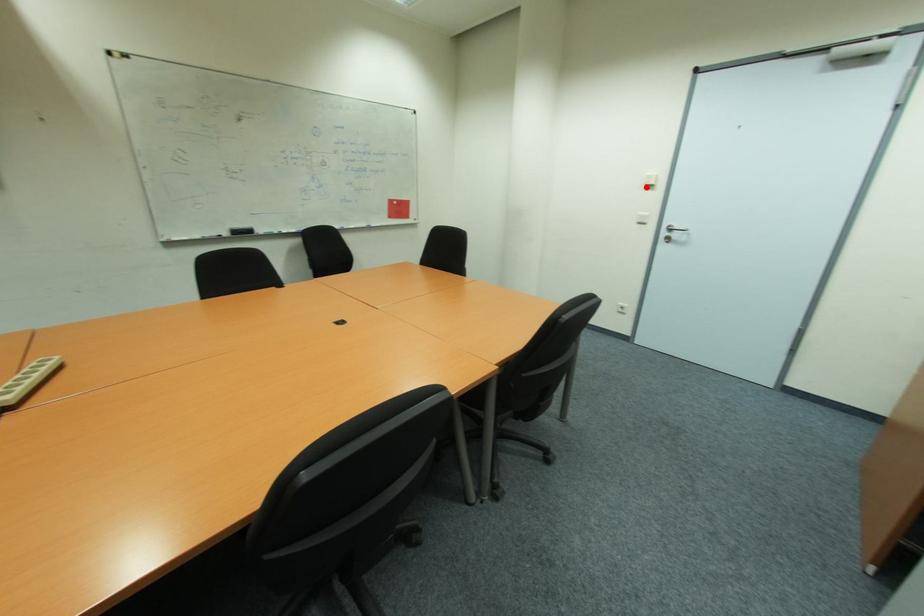
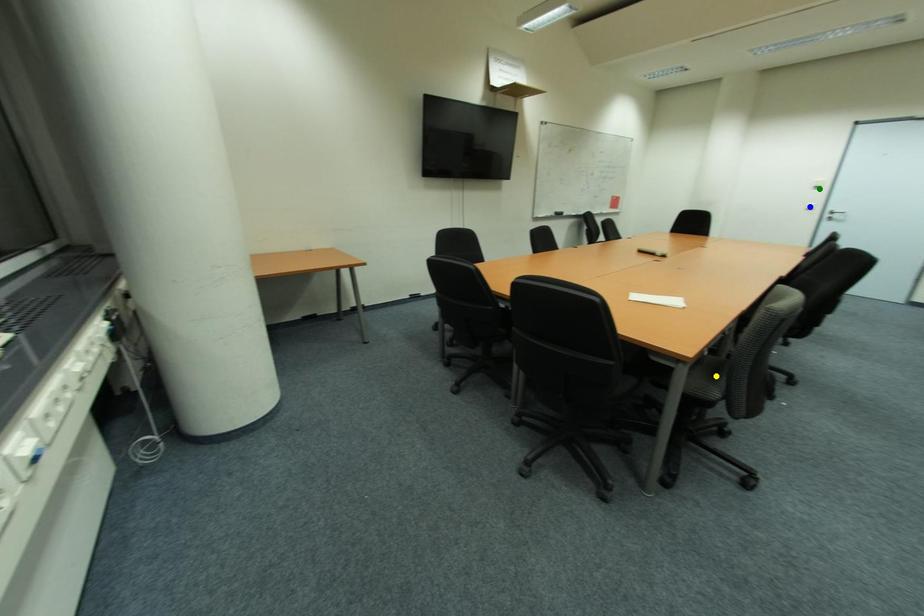
Question: I am providing you with two images of the same scene from different viewpoints. A red point is marked on the first image. You are given multiple points on the second image. Which point in image 2 represents the same 3d spot as the red point in image 1?

Choices:
 (A) blue point
 (B) green point
 (C) yellow point

Answer: (B)